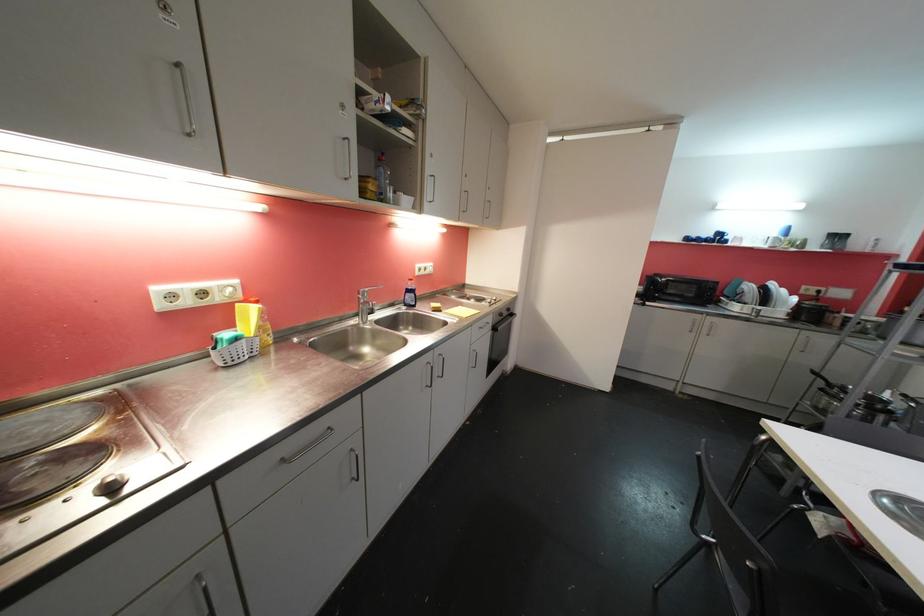
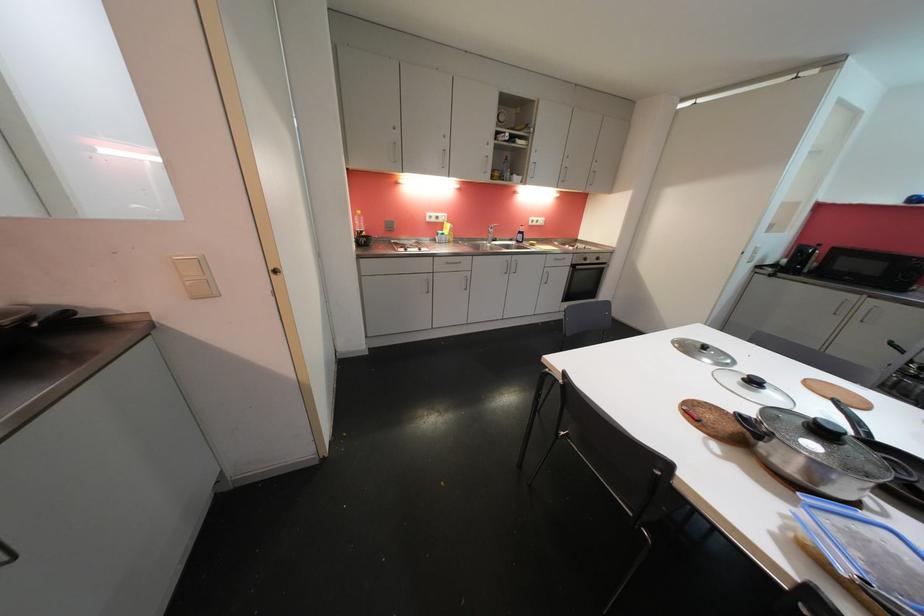
Where in the second image is the point corresponding to (505,317) from the first image?

(590, 262)